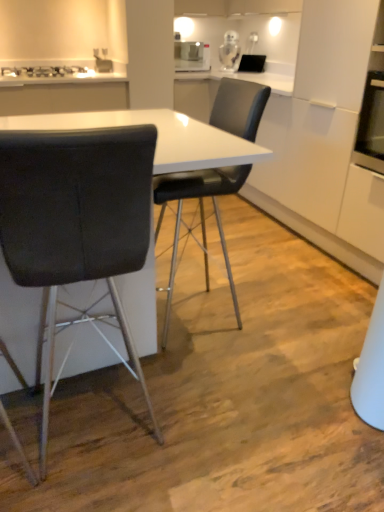
Find the location of a particular element. Image resolution: width=384 pixels, height=512 pixels. vacant space that's between black leather chair at left, which is counted as the first chair, starting from the left, and white glossy table at center is located at coordinates (169, 423).